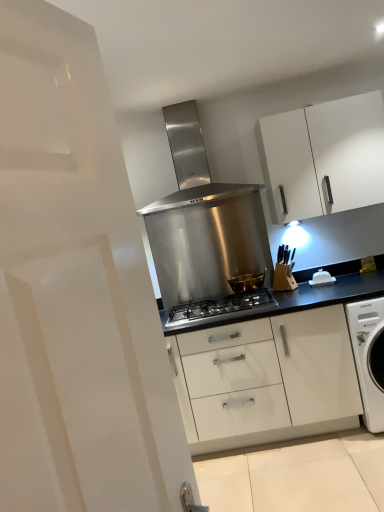
Question: Is white matte cabinet at upper right not within white plastic butter dish at center-right?

Choices:
 (A) yes
 (B) no

Answer: (A)

Question: Can you confirm if white matte cabinet at upper right is positioned to the right of white plastic butter dish at center-right?

Choices:
 (A) yes
 (B) no

Answer: (B)

Question: Is white matte cabinet at upper right surrounding white plastic butter dish at center-right?

Choices:
 (A) yes
 (B) no

Answer: (B)

Question: From a real-world perspective, is white matte cabinet at upper right positioned over white plastic butter dish at center-right based on gravity?

Choices:
 (A) no
 (B) yes

Answer: (B)

Question: Does white matte cabinet at upper right have a greater width compared to white plastic butter dish at center-right?

Choices:
 (A) yes
 (B) no

Answer: (A)

Question: From a real-world perspective, is white matte cabinet at upper right positioned above or below stainless steel range hood at center?

Choices:
 (A) below
 (B) above

Answer: (B)

Question: Is white matte cabinet at upper right bigger or smaller than stainless steel range hood at center?

Choices:
 (A) big
 (B) small

Answer: (A)

Question: Considering the positions of white matte cabinet at upper right and stainless steel range hood at center in the image, is white matte cabinet at upper right taller or shorter than stainless steel range hood at center?

Choices:
 (A) short
 (B) tall

Answer: (A)

Question: Choose the correct answer: Is white matte cabinet at upper right inside stainless steel range hood at center or outside it?

Choices:
 (A) inside
 (B) outside

Answer: (B)

Question: Relative to gold metallic bowl at center, is stainless steel range hood at center in front or behind?

Choices:
 (A) behind
 (B) front

Answer: (A)

Question: Visually, is stainless steel range hood at center positioned to the left or to the right of gold metallic bowl at center?

Choices:
 (A) right
 (B) left

Answer: (B)

Question: From the image's perspective, is stainless steel range hood at center located above or below gold metallic bowl at center?

Choices:
 (A) above
 (B) below

Answer: (A)

Question: Is stainless steel range hood at center bigger or smaller than gold metallic bowl at center?

Choices:
 (A) small
 (B) big

Answer: (B)

Question: From their relative heights in the image, would you say stainless steel gas stove at center is taller or shorter than white matte cabinet at upper right?

Choices:
 (A) tall
 (B) short

Answer: (B)

Question: Does point (210, 304) appear closer or farther from the camera than point (296, 183)?

Choices:
 (A) closer
 (B) farther

Answer: (B)